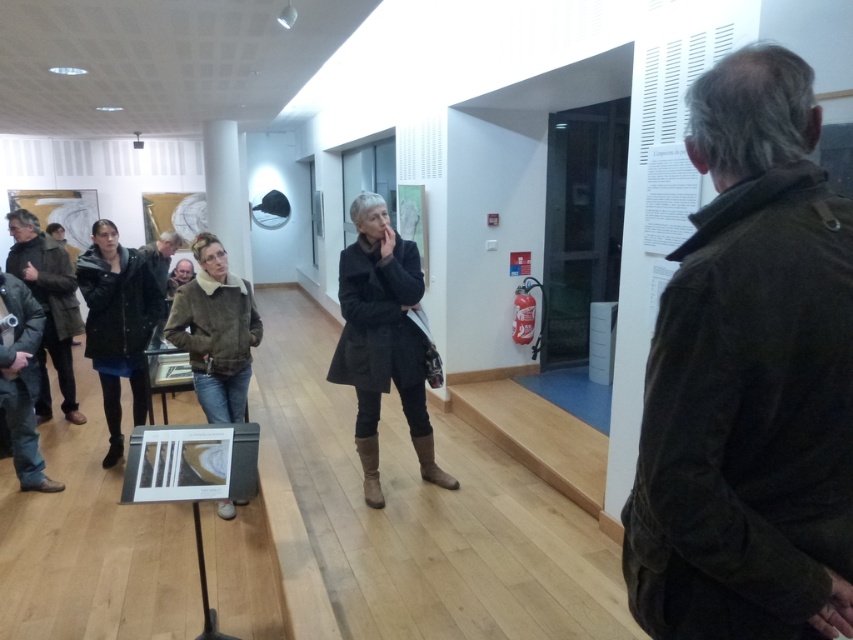
Is dark brown corduroy jacket at upper right below dark brown leather jacket at left?

Correct, dark brown corduroy jacket at upper right is located below dark brown leather jacket at left.

From the picture: Who is more distant from viewer, (x=811, y=440) or (x=68, y=417)?

Positioned behind is point (x=68, y=417).

Does point (708, 365) come farther from viewer compared to point (33, 220)?

No, it is in front of (33, 220).

Identify the location of dark brown corduroy jacket at upper right. (749, 380).

Can you confirm if dark gray wool coat at center is bigger than brown suede jacket at center?

Correct, dark gray wool coat at center is larger in size than brown suede jacket at center.

Is point (375, 326) more distant than point (202, 340)?

No, it is in front of (202, 340).

Identify the location of dark gray wool coat at center. (381, 339).

Is point (213, 342) more distant than point (6, 214)?

No, it is in front of (6, 214).

Is point (216, 376) positioned behind point (28, 236)?

No.

This screenshot has height=640, width=853. I want to click on brown suede jacket at center, so click(x=215, y=332).